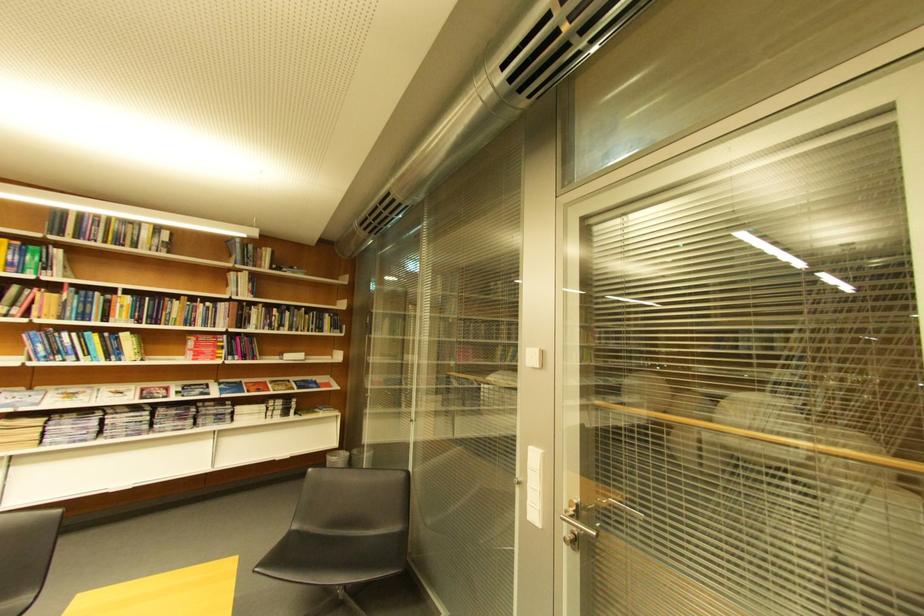
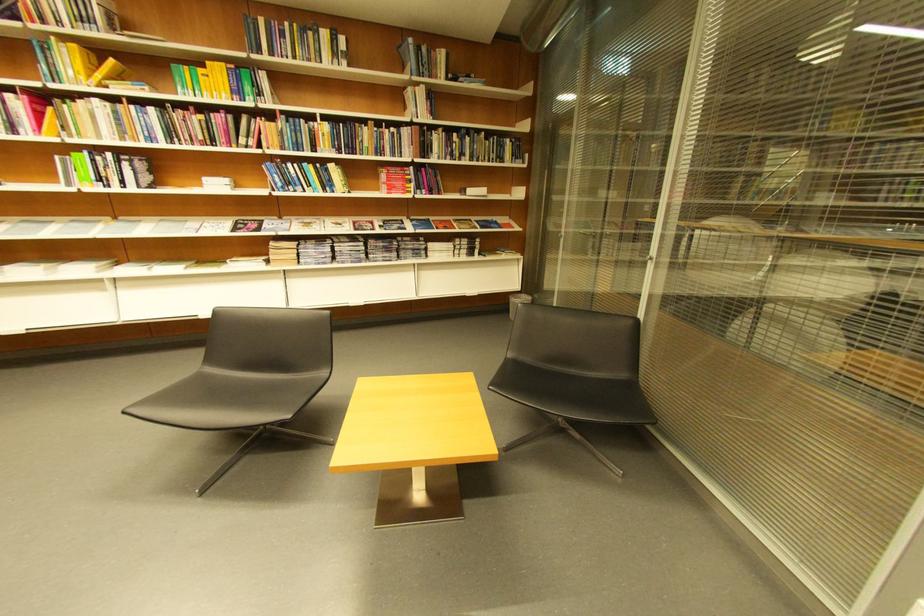
The point at (242,276) is marked in the first image. Where is the corresponding point in the second image?

(419, 91)